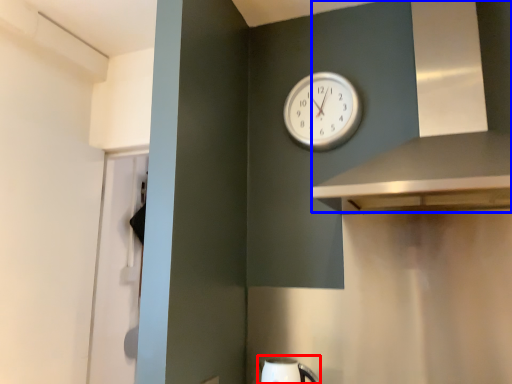
Question: Which object appears closest to the camera in this image, sink (highlighted by a red box) or vent (highlighted by a blue box)?

Choices:
 (A) sink
 (B) vent

Answer: (B)